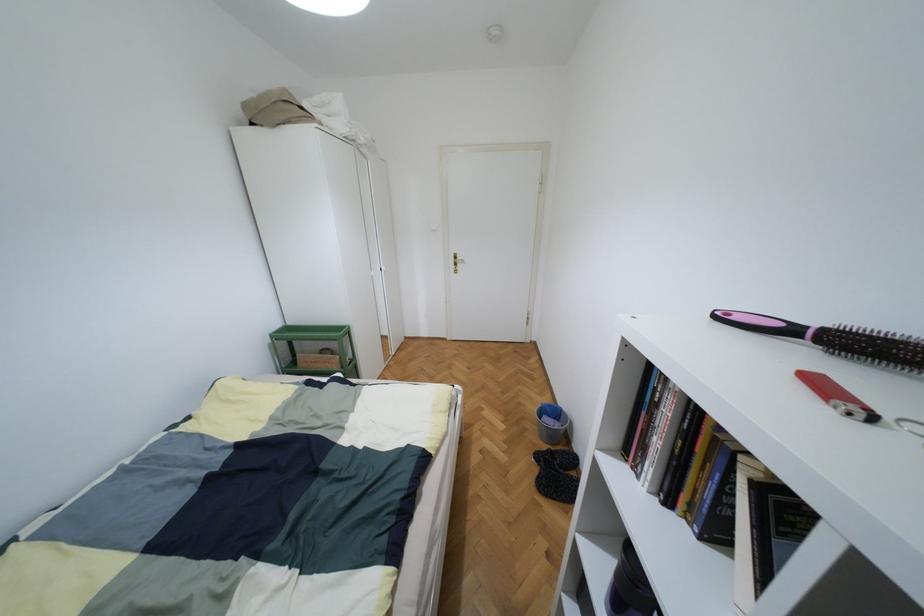
Image resolution: width=924 pixels, height=616 pixels. I want to click on pink and black hairbrush, so click(x=758, y=323).